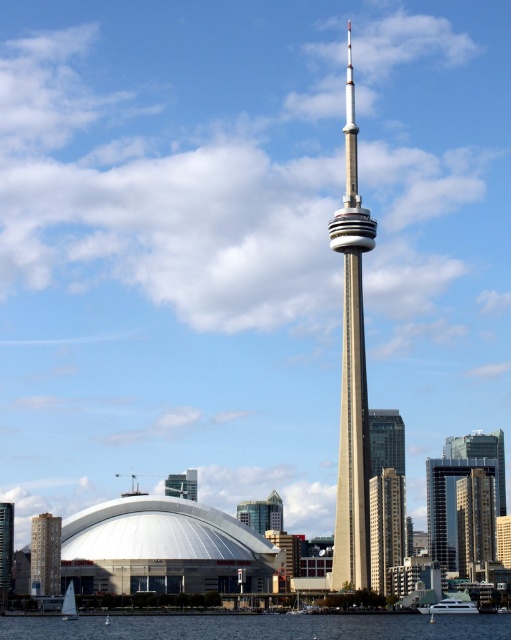
Is point (463, 609) more distant than point (75, 604)?

Yes.

This screenshot has width=511, height=640. I want to click on white glossy boat at lower right, so click(452, 604).

Consider the image. Is silver metallic spire at center to the right of white glass tower at center from the viewer's perspective?

Indeed, silver metallic spire at center is positioned on the right side of white glass tower at center.

Is silver metallic spire at center closer to the viewer compared to white glass tower at center?

Yes.

Does point (343, 321) come closer to viewer compared to point (197, 476)?

Yes, it is.

Identify the location of silver metallic spire at center. Image resolution: width=511 pixels, height=640 pixels. (352, 371).

Can you confirm if white glossy boat at lower right is taller than white glass tower at center?

Yes, white glossy boat at lower right is taller than white glass tower at center.

From the picture: Between white glossy boat at lower right and white glass tower at center, which one is positioned lower?

white glossy boat at lower right

Where is `white glossy boat at lower right`? white glossy boat at lower right is located at coordinates (452, 604).